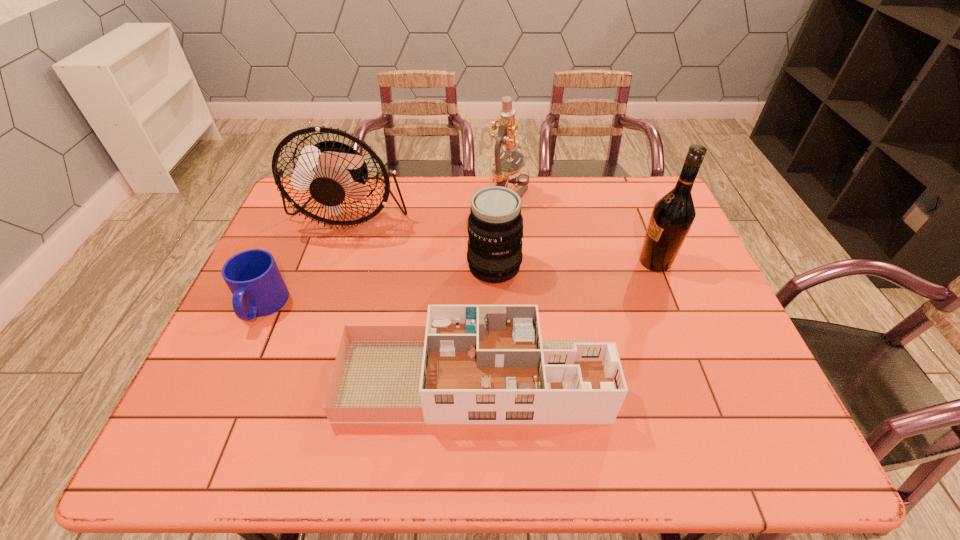
Where is `free space that satisfies the following two spatial constraints: 1. on the front side of the microscope; 2. at the front door of the nearest object`? The height and width of the screenshot is (540, 960). free space that satisfies the following two spatial constraints: 1. on the front side of the microscope; 2. at the front door of the nearest object is located at coordinates (523, 379).